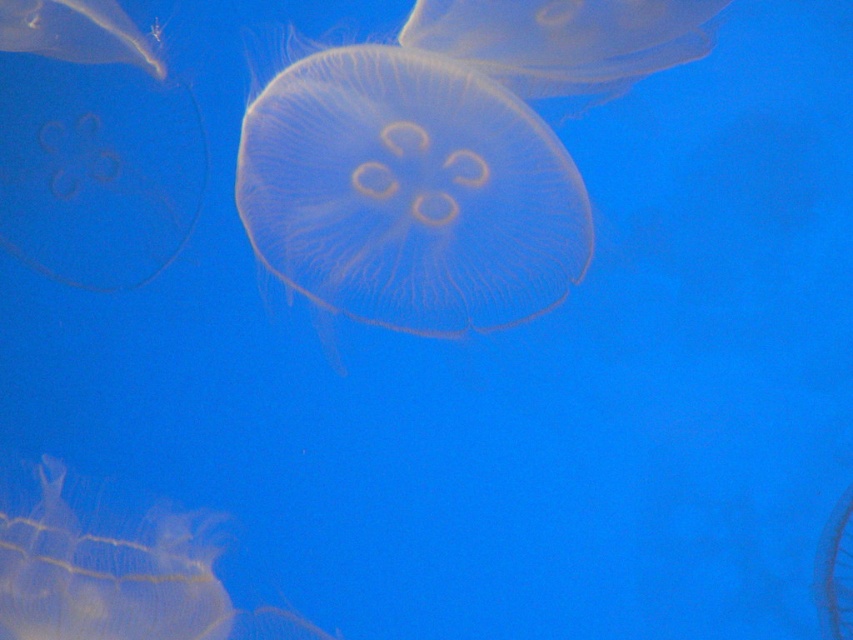
Question: Does translucent gelatinous at center have a lesser width compared to transparent gelatinous at left?

Choices:
 (A) no
 (B) yes

Answer: (A)

Question: Estimate the real-world distances between objects in this image. Which object is closer to the translucent gelatinous at lower left?

Choices:
 (A) transparent gelatinous at upper left
 (B) transparent gelatinous at left
 (C) translucent gelatinous at center

Answer: (B)

Question: Estimate the real-world distances between objects in this image. Which object is closer to the transparent gelatinous at center?

Choices:
 (A) translucent gelatinous at lower left
 (B) translucent gelatinous at center
 (C) transparent gelatinous at left
 (D) transparent gelatinous at upper left

Answer: (B)

Question: Considering the relative positions of translucent gelatinous at center and transparent gelatinous at left in the image provided, where is translucent gelatinous at center located with respect to transparent gelatinous at left?

Choices:
 (A) above
 (B) below

Answer: (B)

Question: Which object is positioned closest to the transparent gelatinous at center?

Choices:
 (A) transparent gelatinous at left
 (B) translucent gelatinous at lower left

Answer: (A)

Question: Does translucent gelatinous at center have a lesser width compared to transparent gelatinous at center?

Choices:
 (A) no
 (B) yes

Answer: (A)